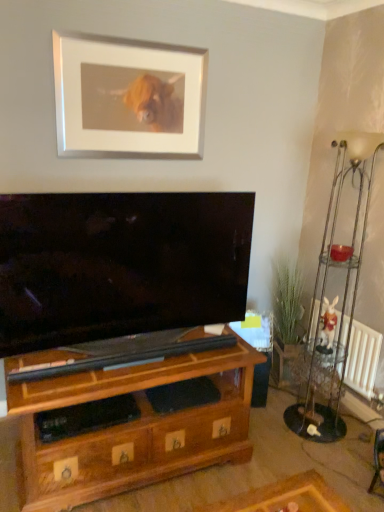
Find the location of a particular element. blank space above white radiator at lower right (from a real-world perspective) is located at coordinates tap(358, 321).